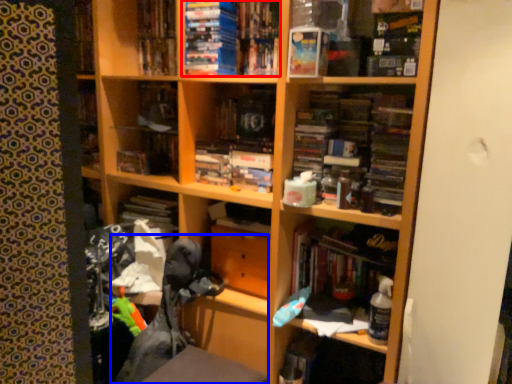
Question: Which object appears farthest to the camera in this image, book (highlighted by a red box) or swivel chair (highlighted by a blue box)?

Choices:
 (A) book
 (B) swivel chair

Answer: (A)